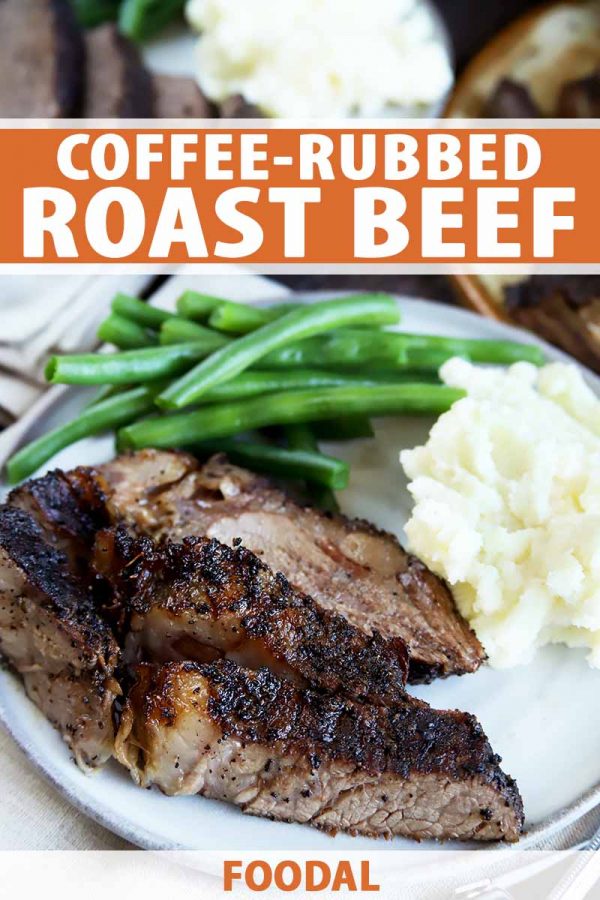
Image resolution: width=600 pixels, height=900 pixels. I want to click on napkins, so click(43, 307).